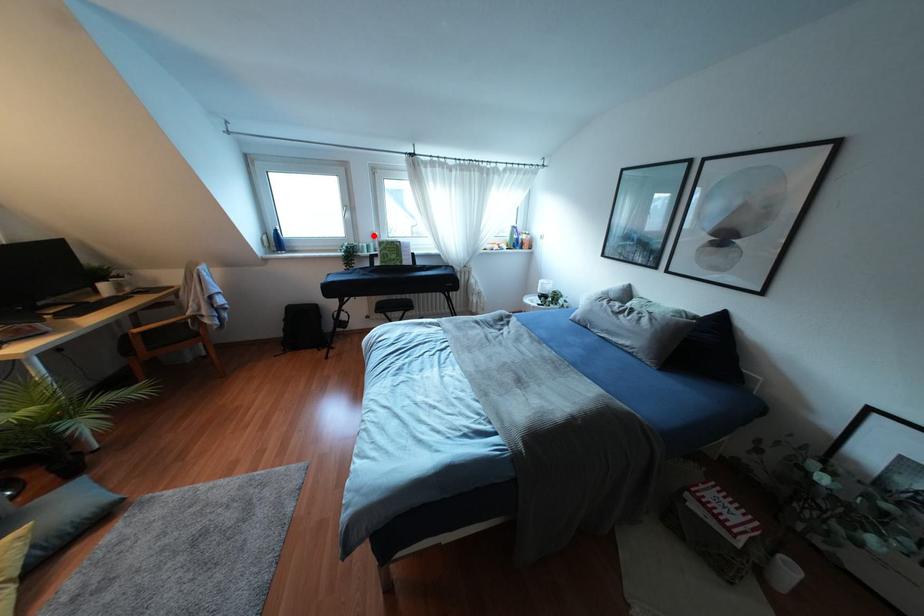
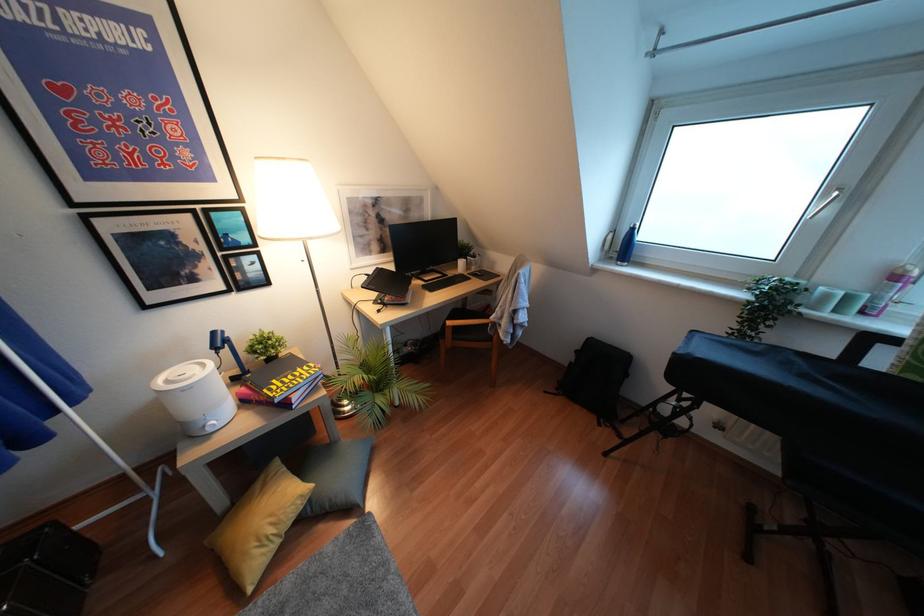
The point at the highlighted location is marked in the first image. Where is the corresponding point in the second image?

(895, 277)